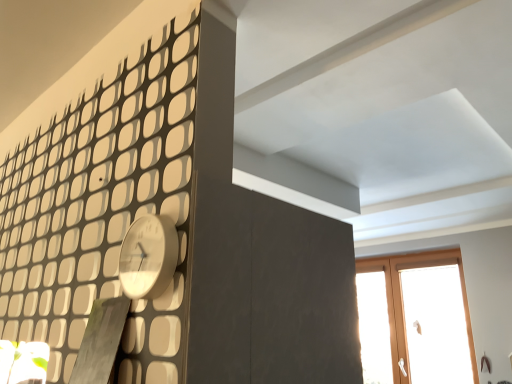
Question: Considering the relative sizes of white glossy clock at upper left and wooden window at upper right in the image provided, is white glossy clock at upper left wider than wooden window at upper right?

Choices:
 (A) no
 (B) yes

Answer: (A)

Question: Can you confirm if white glossy clock at upper left is shorter than wooden window at upper right?

Choices:
 (A) yes
 (B) no

Answer: (A)

Question: Is white glossy clock at upper left aimed at wooden window at upper right?

Choices:
 (A) no
 (B) yes

Answer: (A)

Question: Is white glossy clock at upper left turned away from wooden window at upper right?

Choices:
 (A) no
 (B) yes

Answer: (B)

Question: From the image's perspective, would you say white glossy clock at upper left is shown under wooden window at upper right?

Choices:
 (A) yes
 (B) no

Answer: (B)

Question: Is the position of white glossy clock at upper left more distant than that of wooden window at upper right?

Choices:
 (A) no
 (B) yes

Answer: (A)

Question: Can you confirm if wooden window at upper right is thinner than white glossy clock at upper left?

Choices:
 (A) no
 (B) yes

Answer: (A)

Question: Can you confirm if wooden window at upper right is taller than white glossy clock at upper left?

Choices:
 (A) no
 (B) yes

Answer: (B)

Question: Would you say wooden window at upper right is a long distance from white glossy clock at upper left?

Choices:
 (A) yes
 (B) no

Answer: (A)

Question: Is wooden window at upper right smaller than white glossy clock at upper left?

Choices:
 (A) no
 (B) yes

Answer: (A)

Question: Is wooden window at upper right positioned behind white glossy clock at upper left?

Choices:
 (A) no
 (B) yes

Answer: (B)

Question: Considering the relative sizes of wooden window at upper right and white glossy clock at upper left in the image provided, is wooden window at upper right bigger than white glossy clock at upper left?

Choices:
 (A) yes
 (B) no

Answer: (A)

Question: In terms of height, does white glossy clock at upper left look taller or shorter compared to wooden window at upper right?

Choices:
 (A) short
 (B) tall

Answer: (A)